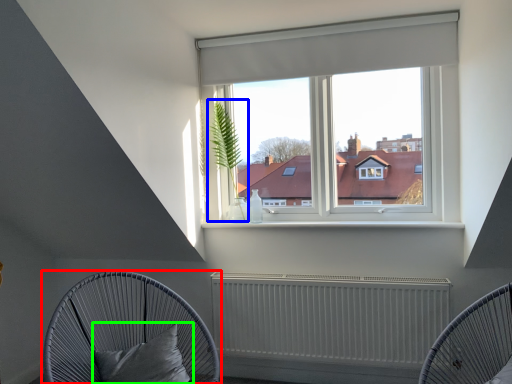
Question: Based on their relative distances, which object is nearer to furniture (highlighted by a red box)? Choose from plant (highlighted by a blue box) and pillow (highlighted by a green box).

Choices:
 (A) plant
 (B) pillow

Answer: (B)